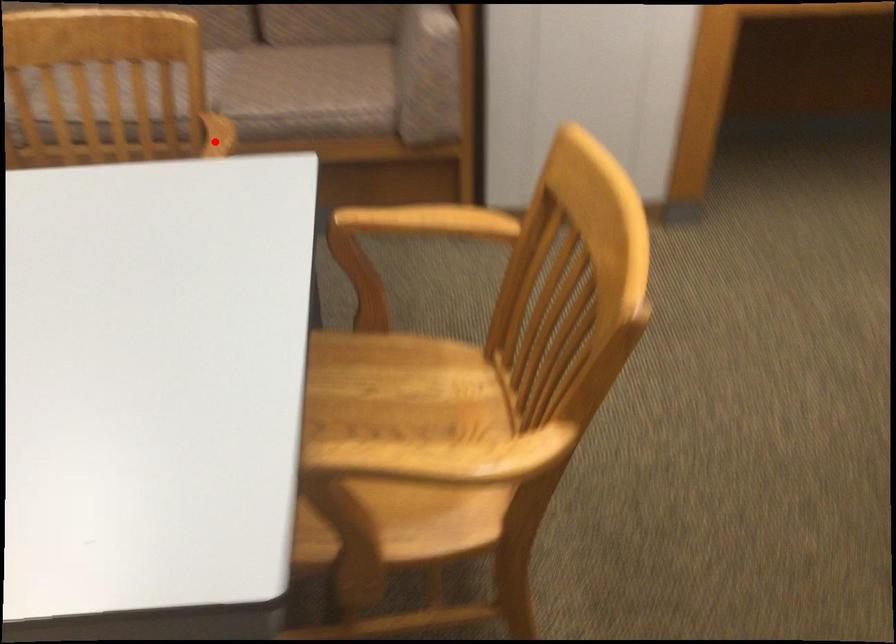
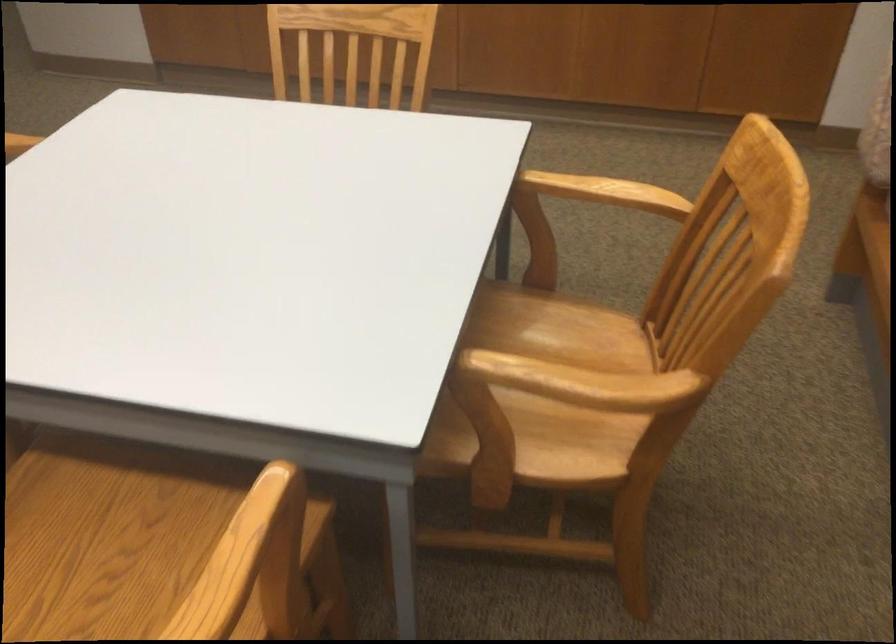
Question: I am providing you with two images of the same scene from different viewpoints. Given a red point in image1, look at the same physical point in image2. Is it:

Choices:
 (A) Closer to the viewpoint
 (B) Farther from the viewpoint

Answer: (A)